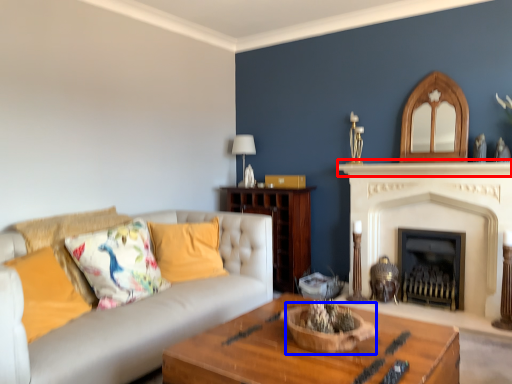
Question: Which object is closer to the camera taking this photo, mantle (highlighted by a red box) or basket (highlighted by a blue box)?

Choices:
 (A) mantle
 (B) basket

Answer: (B)